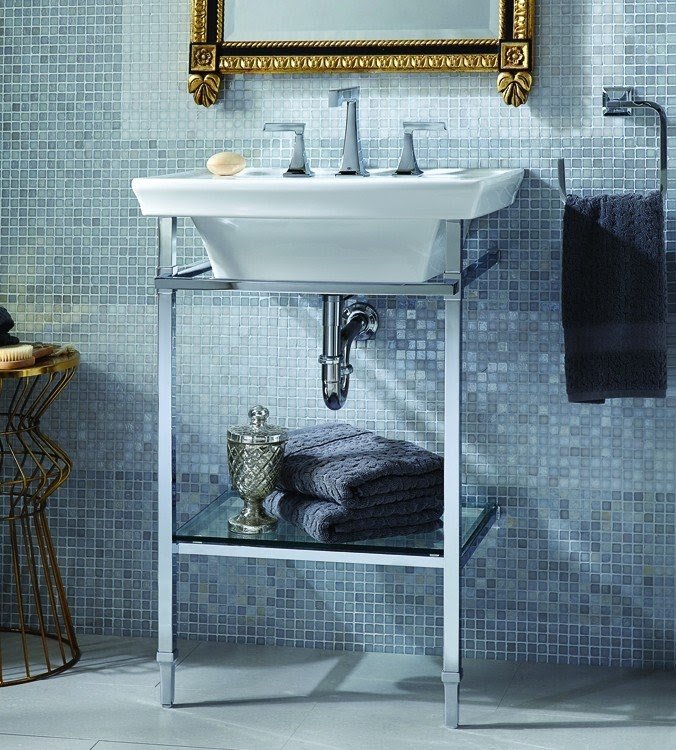
Locate an element on the screen. The image size is (676, 750). towel is located at coordinates (378, 507).